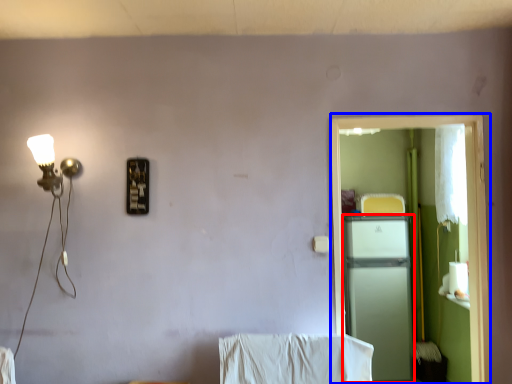
Question: Which point is closer to the camera, appliance (highlighted by a red box) or screen door (highlighted by a blue box)?

Choices:
 (A) appliance
 (B) screen door

Answer: (B)